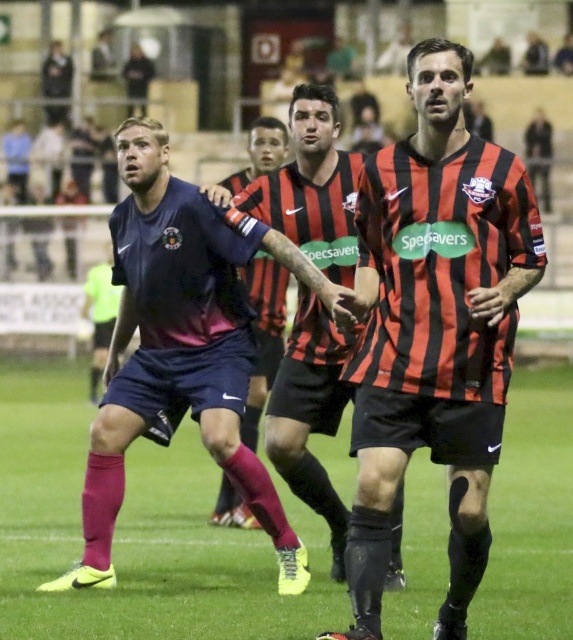
You are a soccer coach analyzing the field layout. You notice the red and black striped jersey at center and the dark blue jersey at left. Which player has a narrower uniform width?

The red and black striped jersey at center has a narrower uniform width than the dark blue jersey at left.

You are a photographer positioned at the edge of the soccer field. You want to take a photo focusing on the red and black striped jersey at center and the dark blue jersey at left. Which player will appear larger in your photo?

The red and black striped jersey at center will appear larger in the photo because it is closer to the viewer than the dark blue jersey at left.